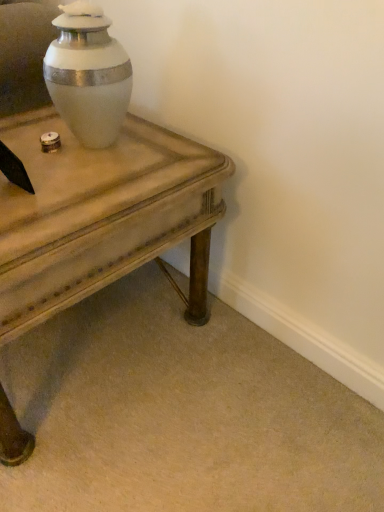
This screenshot has height=512, width=384. Identify the location of vacant space to the right of white glossy urn at upper center. (164, 152).